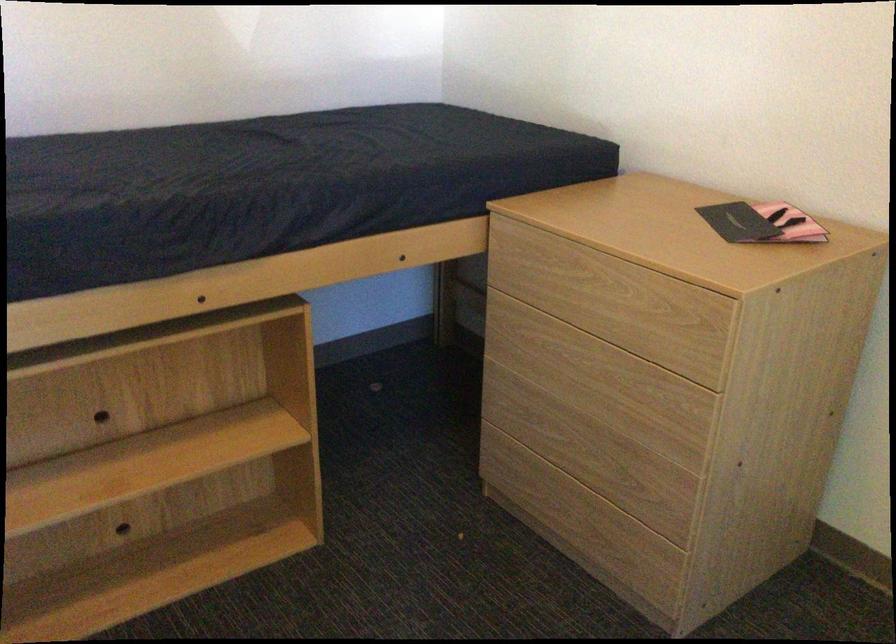
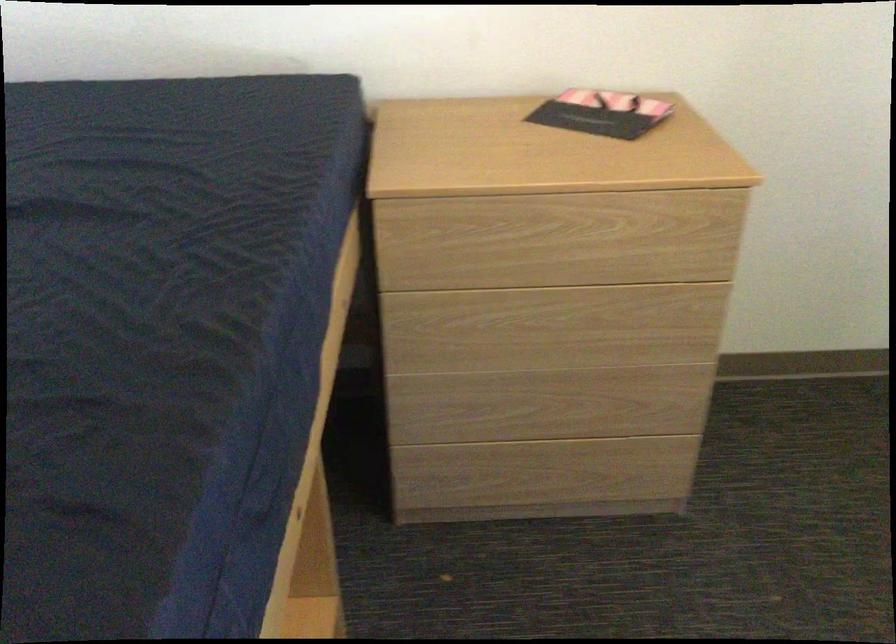
Where in the second image is the point corresponding to point (583, 290) from the first image?

(557, 240)